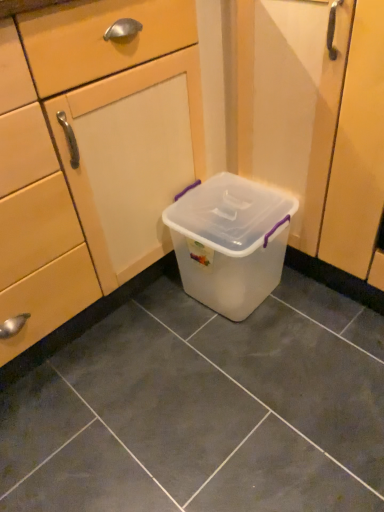
Identify the location of vacant space to the right of transparent plastic storage box at center. Image resolution: width=384 pixels, height=512 pixels. (325, 304).